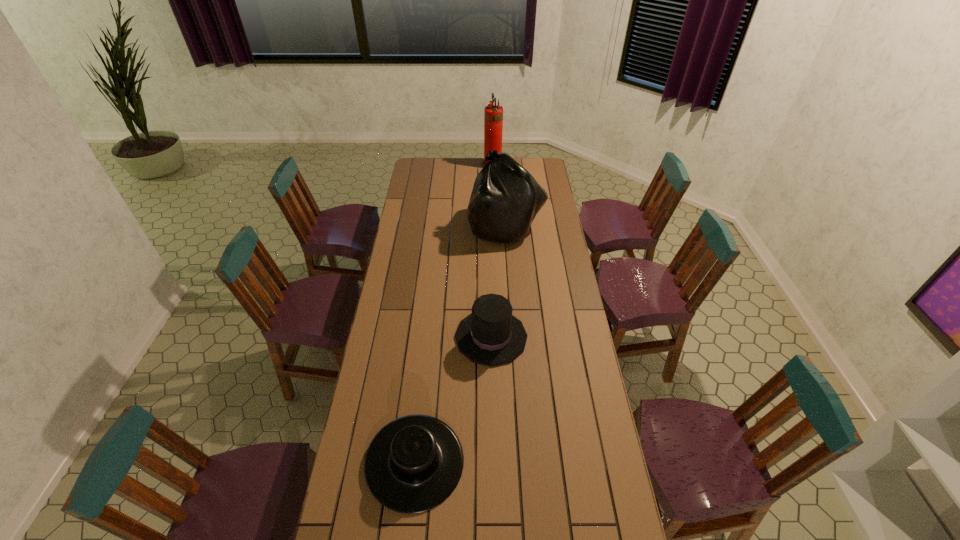
Where is `the farthest object`? the farthest object is located at coordinates (493, 114).

Where is `plastic bag`? plastic bag is located at coordinates (505, 199).

I want to click on the farther dress hat, so click(x=490, y=335).

Where is `the second shortest object`? The image size is (960, 540). the second shortest object is located at coordinates (490, 335).

Find the location of a particular element. This screenshot has width=960, height=540. the shortest object is located at coordinates (413, 464).

Locate an element on the screen. the nearest object is located at coordinates (413, 464).

Find the location of `vacant point located at the discharge end of the farthest object`. vacant point located at the discharge end of the farthest object is located at coordinates (420, 165).

Locate an element on the screen. Image resolution: width=960 pixels, height=540 pixels. blank space located at the discharge end of the farthest object is located at coordinates (444, 165).

At what (x,y) coordinates should I click in order to perform the action: click on vacant area located at the discharge end of the farthest object. Please return your answer as a coordinate pair (x, y). The width and height of the screenshot is (960, 540). Looking at the image, I should click on (459, 165).

You are a GUI agent. You are given a task and a screenshot of the screen. Output one action in this format:
    pyautogui.click(x=<x>, y=<y>)
    Task: Click on the free space located 0.070m on the back of the third nearest object
    Image resolution: width=960 pixels, height=540 pixels.
    Given the screenshot: What is the action you would take?
    pyautogui.click(x=504, y=199)